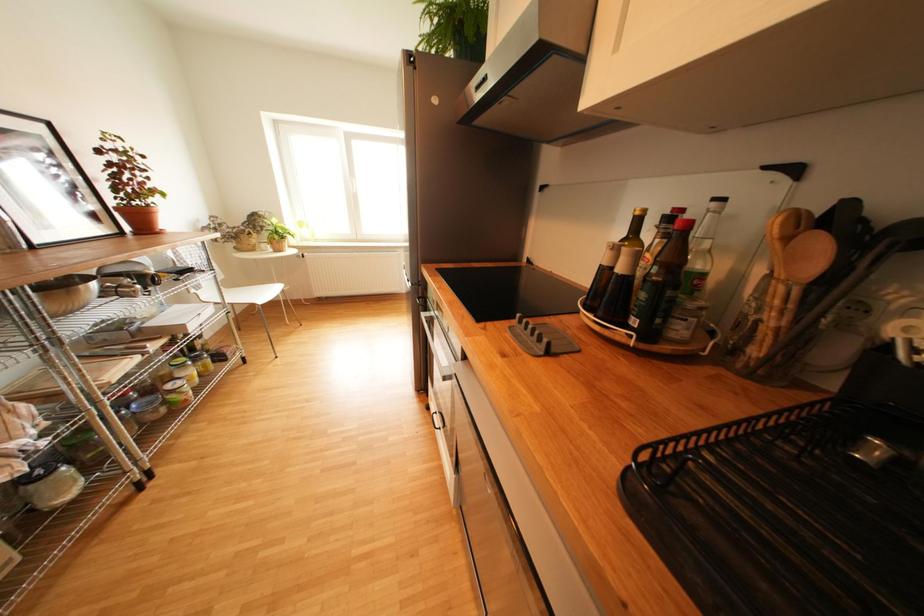
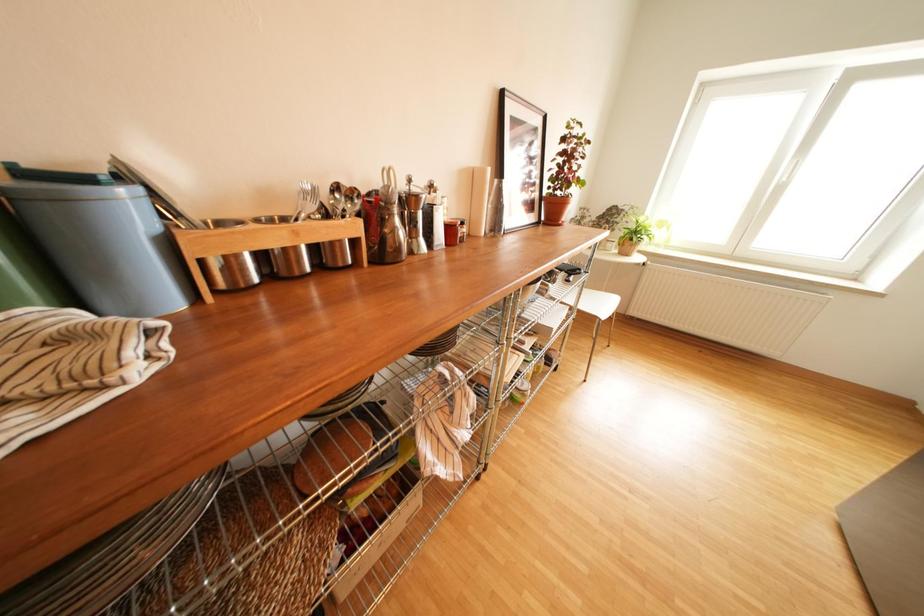
Question: The camera is either moving clockwise (left) or counter-clockwise (right) around the object. The first image is from the beginning of the video and the second image is from the end. Is the camera moving left or right when shooting the video?

Choices:
 (A) Left
 (B) Right

Answer: (B)